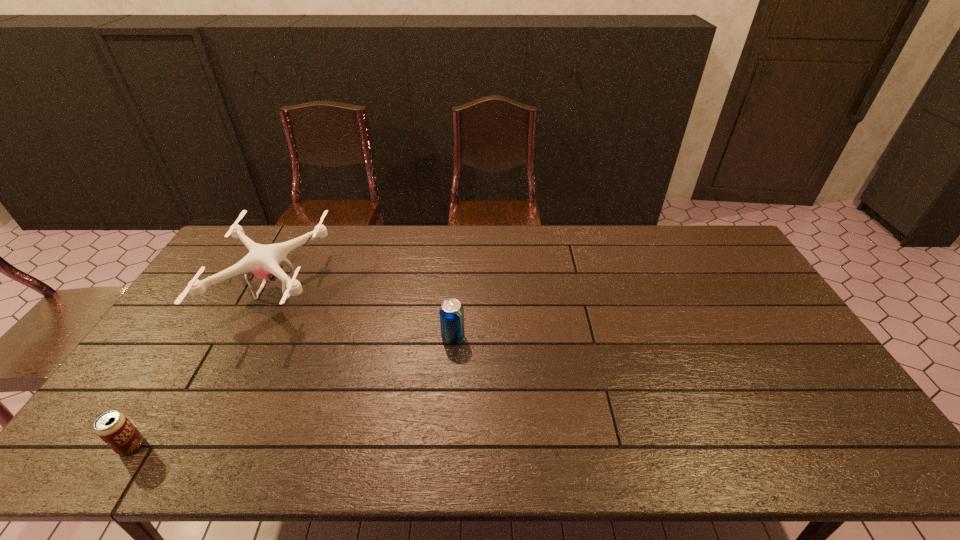
Where is `drone`? Image resolution: width=960 pixels, height=540 pixels. drone is located at coordinates (262, 261).

Locate an element on the screen. The width and height of the screenshot is (960, 540). the taller beer can is located at coordinates (451, 312).

Image resolution: width=960 pixels, height=540 pixels. I want to click on the second tallest object, so click(451, 312).

Locate an element on the screen. the shortest object is located at coordinates (114, 428).

Where is `the left beer can`? This screenshot has width=960, height=540. the left beer can is located at coordinates (114, 428).

The width and height of the screenshot is (960, 540). I want to click on free space located on the top of the tallest object, so click(401, 289).

Find the location of a particular element. Image resolution: width=960 pixels, height=540 pixels. vacant region located on the front of the second tallest object is located at coordinates (448, 414).

Where is `free space located on the left of the shorter beer can`? free space located on the left of the shorter beer can is located at coordinates (98, 446).

Where is `object positioned at the far edge`? The width and height of the screenshot is (960, 540). object positioned at the far edge is located at coordinates (262, 261).

You are a GUI agent. You are given a task and a screenshot of the screen. Output one action in this format:
    pyautogui.click(x=<x>, y=<y>)
    Task: Click on the object located at the near edge
    This screenshot has width=960, height=540.
    Given the screenshot: What is the action you would take?
    pyautogui.click(x=114, y=428)